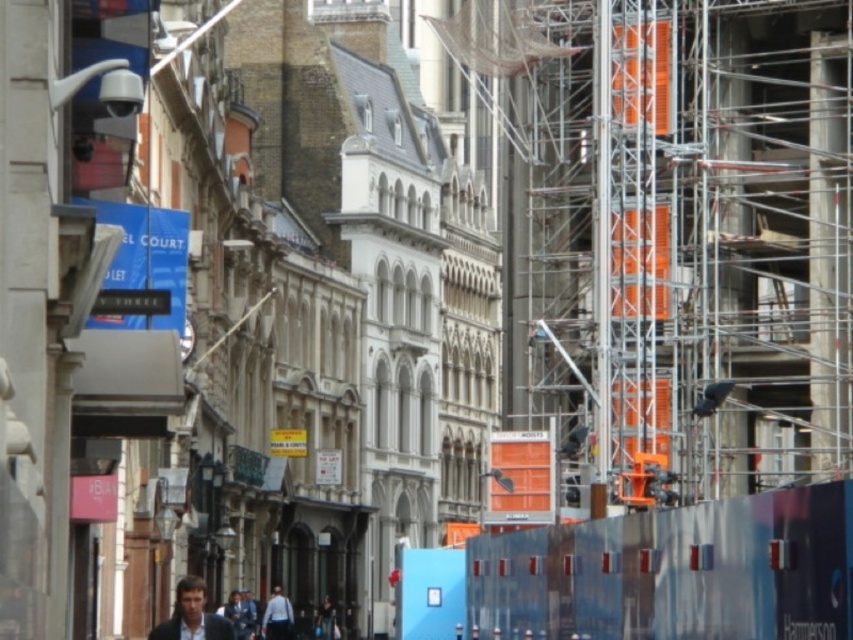
Question: Does light brown leather jacket at lower center appear under light blue shirt at lower center?

Choices:
 (A) yes
 (B) no

Answer: (B)

Question: Which object appears closest to the camera in this image?

Choices:
 (A) light blue shirt at lower center
 (B) light brown leather jacket at lower center

Answer: (B)

Question: Is light brown leather jacket at lower center further to the viewer compared to light blue shirt at lower center?

Choices:
 (A) no
 (B) yes

Answer: (A)

Question: Can you confirm if light brown leather jacket at lower center is positioned to the left of light blue shirt at lower center?

Choices:
 (A) no
 (B) yes

Answer: (B)

Question: Among these points, which one is farthest from the camera?

Choices:
 (A) (198, 632)
 (B) (270, 636)

Answer: (B)